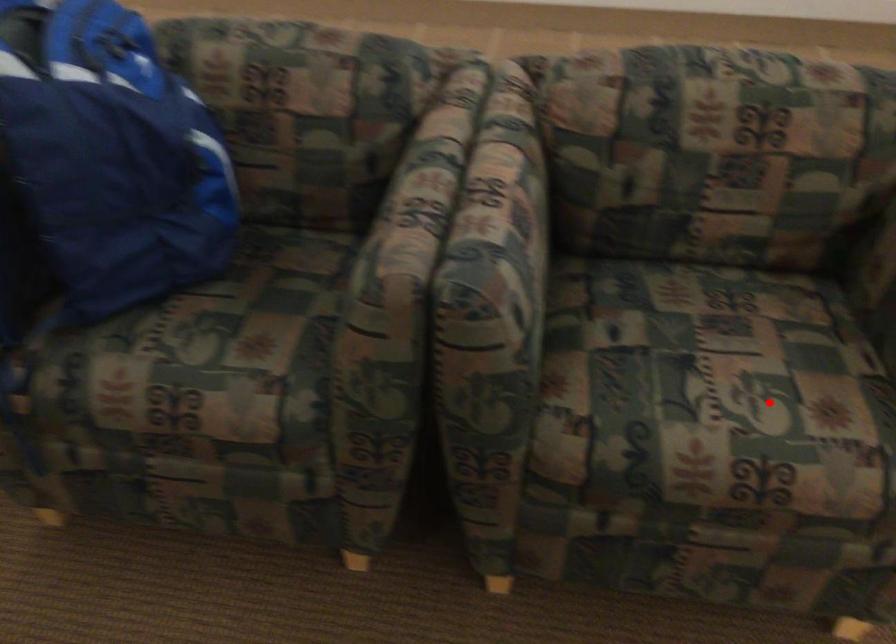
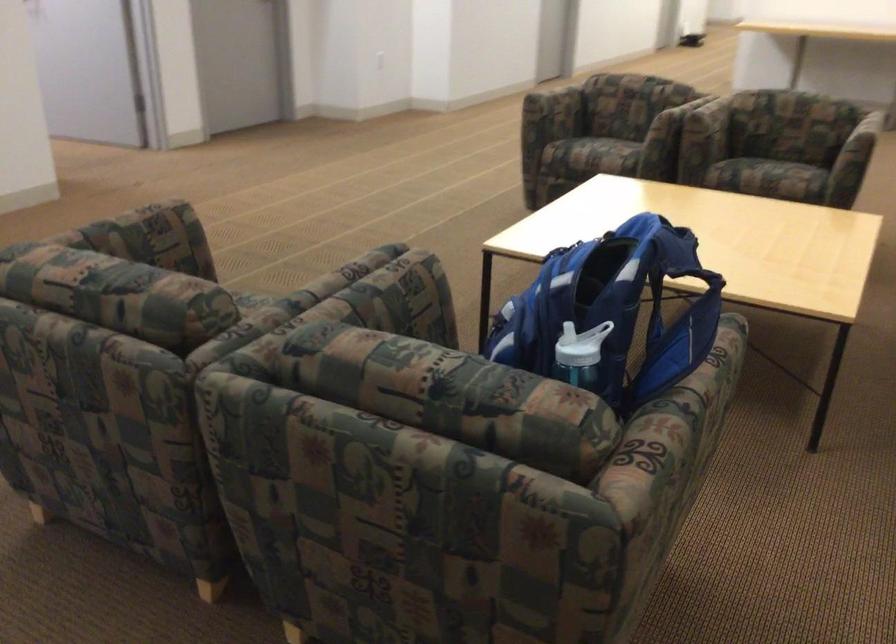
Find the pixel in the second image that matches the highlighted location in the first image.

(250, 298)